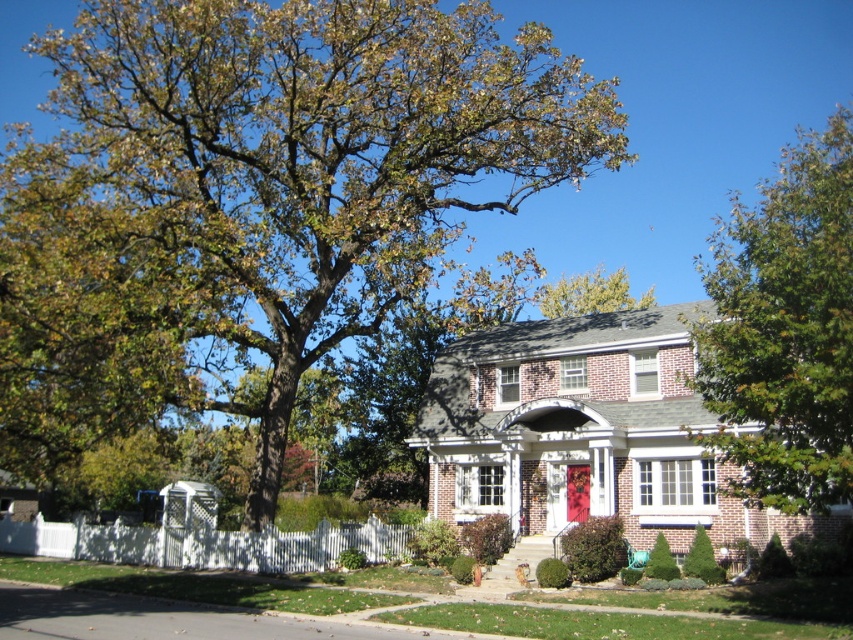
You are a painter who needs to paint the red matte door at center and the green leafy tree at upper right. If you have a ladder that can reach 2 meters, can you paint both without moving the ladder?

The green leafy tree at upper right might be wider than red matte door at center, so the ladder might not reach the entire width of the tree. You may need to move the ladder to paint the wider parts of the green leafy tree at upper right.

From the picture: You are standing at the front door of the house and want to walk towards the point labeled point [489,45]. Will you pass by point [547,307] before reaching your destination?

Yes, you will pass by point [547,307] before reaching point [489,45] because point [489,45] is behind point [547,307].

You are standing in front of the house and want to see the red matte door at center clearly. However, the green leafy tree at upper right is blocking your view. How can you adjust your position to avoid the obstruction?

Move to the left side of the house so that the green leafy tree at upper right is no longer in front of the red matte door at center.